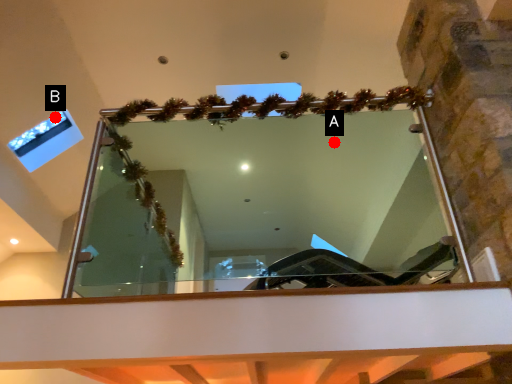
Question: Two points are circled on the image, labeled by A and B beside each circle. Which point appears closest to the camera in this image?

Choices:
 (A) A is closer
 (B) B is closer

Answer: (B)